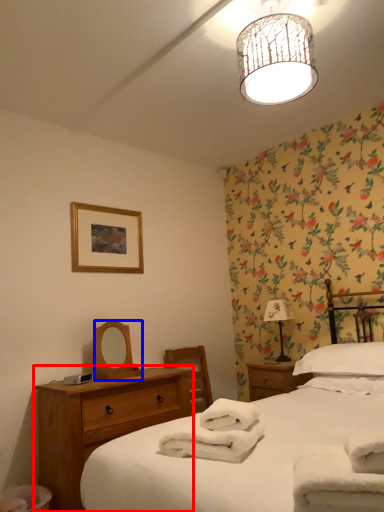
Question: Which of the following is the closest to the observer, nightstand (highlighted by a red box) or mirror (highlighted by a blue box)?

Choices:
 (A) nightstand
 (B) mirror

Answer: (A)